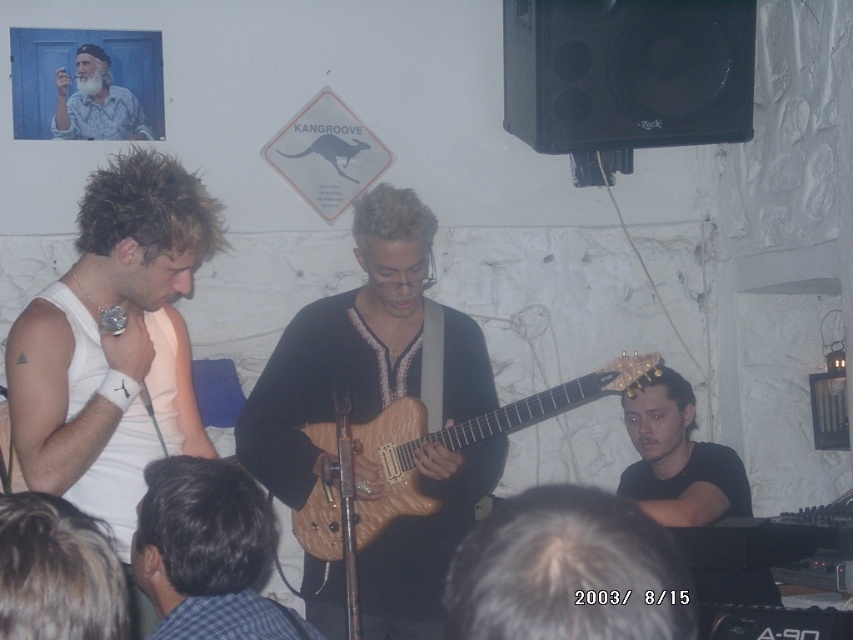
Question: Can you confirm if natural wood electric guitar at center is positioned below black matte shirt at lower right?

Choices:
 (A) no
 (B) yes

Answer: (A)

Question: Is wooden guitar at center to the left of natural wood electric guitar at center from the viewer's perspective?

Choices:
 (A) yes
 (B) no

Answer: (A)

Question: Among these points, which one is nearest to the camera?

Choices:
 (A) (553, 412)
 (B) (170, 321)
 (C) (668, 417)
 (D) (238, 515)

Answer: (D)

Question: Among these points, which one is farthest from the camera?

Choices:
 (A) (637, 525)
 (B) (283, 460)

Answer: (B)

Question: Can you confirm if wooden guitar at center is smaller than white matte tank top at left?

Choices:
 (A) no
 (B) yes

Answer: (A)

Question: Based on their relative distances, which object is farther from the black matte shirt at lower right?

Choices:
 (A) brown leather jacket at lower left
 (B) wooden guitar at center
 (C) white matte tank top at left

Answer: (A)